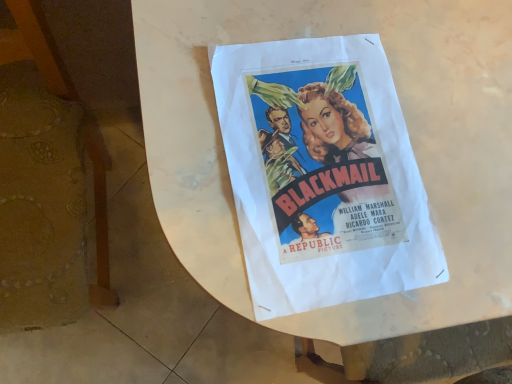
Question: Looking at the image, does matte paper poster at center seem bigger or smaller compared to white paper at center?

Choices:
 (A) small
 (B) big

Answer: (A)

Question: From a real-world perspective, is matte paper poster at center positioned above or below white paper at center?

Choices:
 (A) below
 (B) above

Answer: (B)

Question: Which object is positioned closest to the white paper at center?

Choices:
 (A) matte paper poster at center
 (B) wooden chair at left

Answer: (A)

Question: Which object is the farthest from the wooden chair at left?

Choices:
 (A) matte paper poster at center
 (B) white paper at center

Answer: (A)